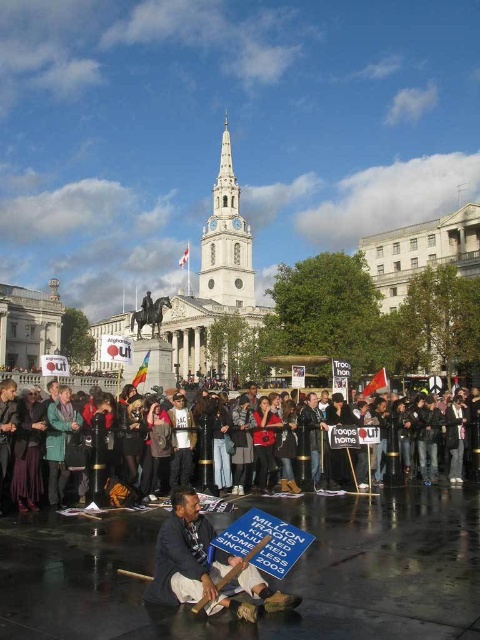
Question: Is blue fabric sign at lower center to the left of dark brown leather jacket at center from the viewer's perspective?

Choices:
 (A) no
 (B) yes

Answer: (A)

Question: Which point is closer to the camera?

Choices:
 (A) blue fabric sign at lower center
 (B) dark brown leather jacket at center

Answer: (A)

Question: Does blue fabric sign at lower center have a greater width compared to dark brown leather jacket at center?

Choices:
 (A) no
 (B) yes

Answer: (A)

Question: Is blue fabric sign at lower center to the left of dark brown leather jacket at center from the viewer's perspective?

Choices:
 (A) yes
 (B) no

Answer: (B)

Question: Among these points, which one is nearest to the camera?

Choices:
 (A) (432, 470)
 (B) (176, 492)

Answer: (B)